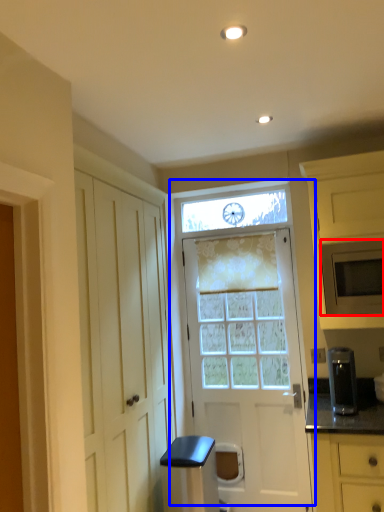
Question: Which object appears farthest to the camera in this image, microwave oven (highlighted by a red box) or door (highlighted by a blue box)?

Choices:
 (A) microwave oven
 (B) door

Answer: (B)